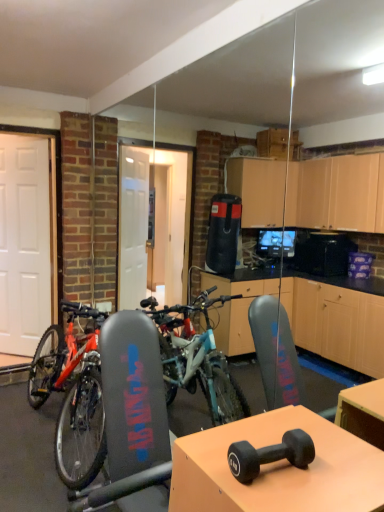
The height and width of the screenshot is (512, 384). Identify the location of unoccupied area behind black rubber dumbbell at center. (254, 430).